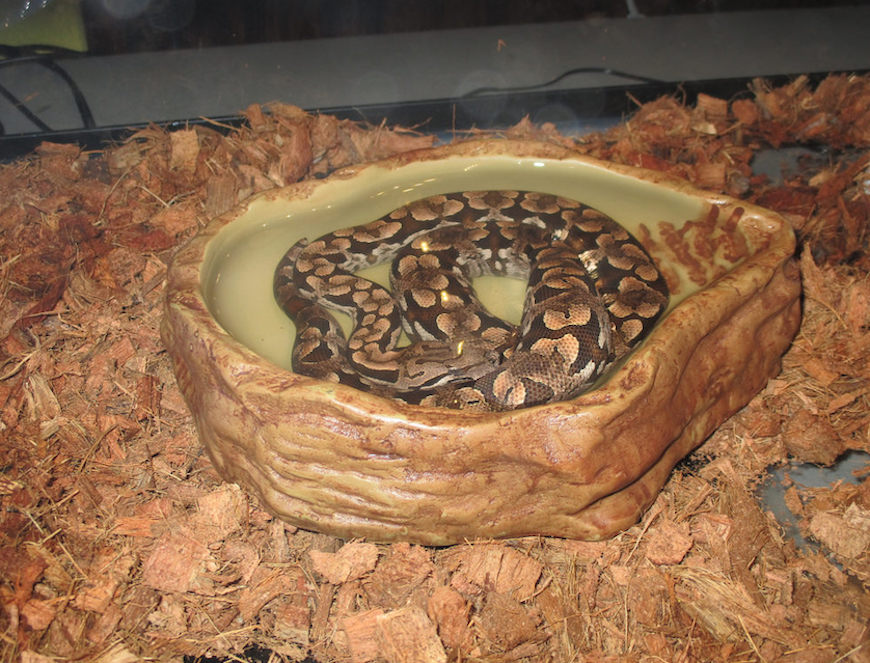
You are a GUI agent. You are given a task and a screenshot of the screen. Output one action in this format:
    pyautogui.click(x=<x>, y=<y>)
    Task: Click on the table top
    The width and height of the screenshot is (870, 663).
    Given the screenshot: What is the action you would take?
    pyautogui.click(x=419, y=75)